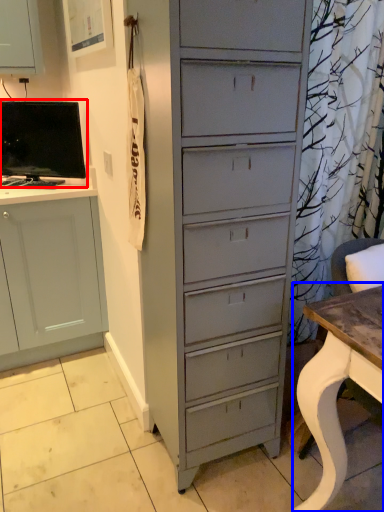
Question: Among these objects, which one is farthest to the camera, computer monitor (highlighted by a red box) or desk (highlighted by a blue box)?

Choices:
 (A) computer monitor
 (B) desk

Answer: (A)